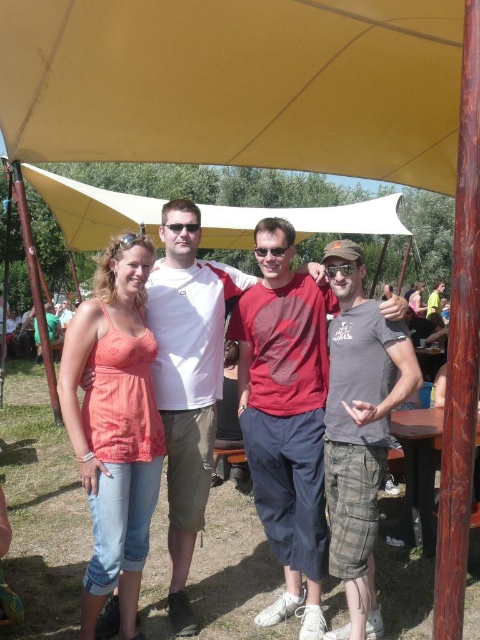
You are standing at the center of the image and want to hand a gift to the person wearing the matte coral tank top at left. In which direction should you move to reach them?

The matte coral tank top at left is located at point 0.667 on the x and 0.240 on the y axis. Since you are at the center, you should move to the left and slightly downward to reach the person wearing the matte coral tank top at left.

You are planning to take a photo under the yellow fabric canopy at upper center and need to ensure that the matte red shirt at center is fully visible. Given their sizes, will the canopy overshadow the shirt?

The yellow fabric canopy at upper center is larger in size than the matte red shirt at center, so it could potentially overshadow the shirt depending on positioning. To ensure visibility, position the shirt away from the canopy or adjust the angle to avoid obstruction.